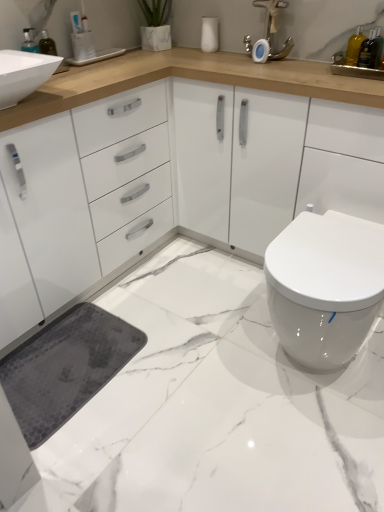
This screenshot has height=512, width=384. In order to click on vacant point above white glossy toilet at lower right (from a real-world perspective) in this screenshot , I will do `click(338, 247)`.